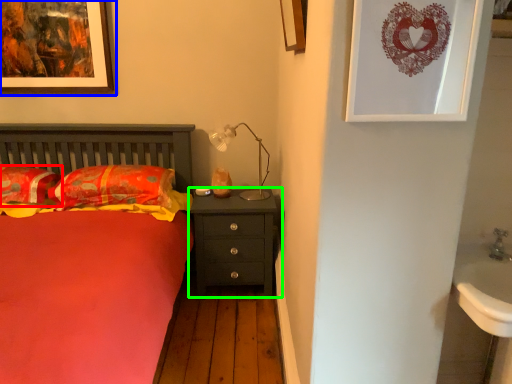
Question: Considering the real-world distances, which object is farthest from pillow (highlighted by a red box)? picture frame (highlighted by a blue box) or nightstand (highlighted by a green box)?

Choices:
 (A) picture frame
 (B) nightstand

Answer: (B)